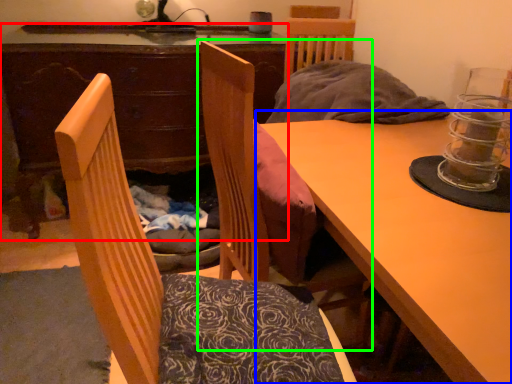
Question: Estimate the real-world distances between objects in this image. Which object is farther from desk (highlighted by a red box), table (highlighted by a blue box) or chair (highlighted by a green box)?

Choices:
 (A) table
 (B) chair

Answer: (A)